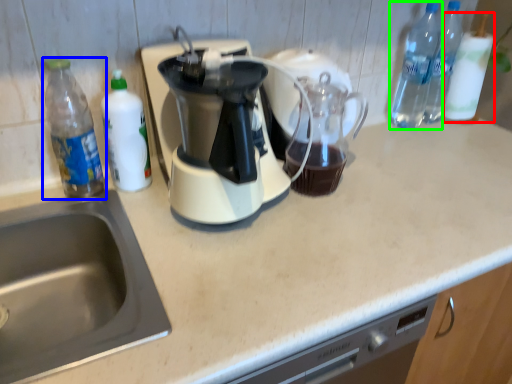
Question: Which object is the farthest from bottle (highlighted by a red box)? Choose among these: bottle (highlighted by a blue box) or bottle (highlighted by a green box).

Choices:
 (A) bottle
 (B) bottle

Answer: (A)